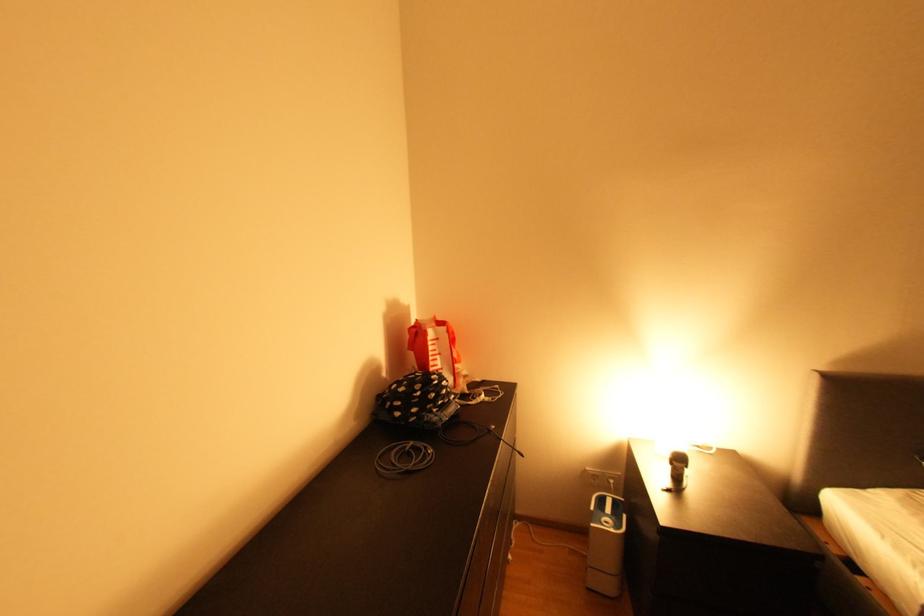
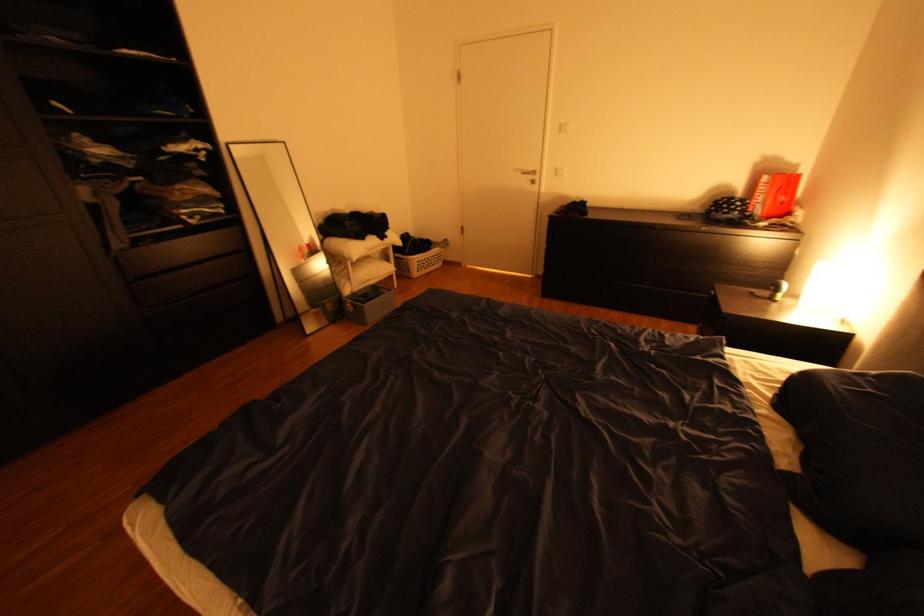
The point at (457, 389) is marked in the first image. Where is the corresponding point in the second image?

(748, 208)